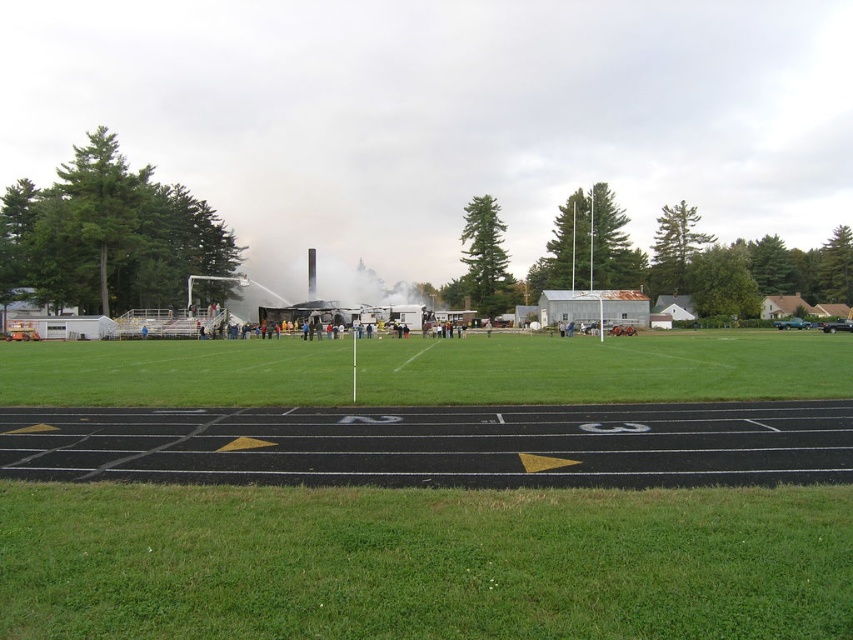
You are a firefighter arriving at the scene. You see the green grass at center and the white smoke at center. Which object is higher in elevation?

The white smoke at center is higher in elevation than the green grass at center because the green grass at center is below it.

You are an athlete preparing for a sprint race. You notice the black asphalt race track at lower center and the green grass at center. Which surface covers a smaller area in the image?

The black asphalt race track at lower center occupies less space than the green grass at center, so the black asphalt race track at lower center covers a smaller area.

You are a drone operator trying to capture aerial footage of the black asphalt race track at lower center. Your drone has a maximum flight distance of 8 meters. Can your drone reach the track without exceeding its limit?

The black asphalt race track at lower center is 7.84 meters from camera, so yes, the drone can reach it since the distance is within the 8 meters limit.